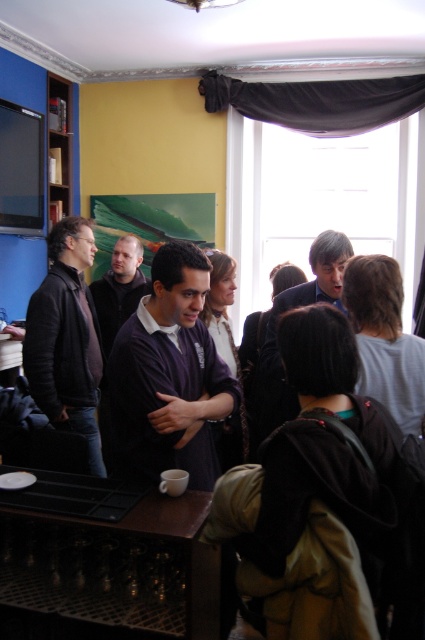
You are standing at the blue accent wall on the left side of the room and want to reach the table with the black tray. There are two points marked in the scene, point A at coordinates point A is point [235,396] and point B is point [127,250]. Which point should you walk towards to get to the table more quickly?

Point A at coordinates point [235,396] is in front of point B at coordinates point [127,250], so you should walk towards point A to reach the table more quickly.

You are standing in the room and want to pick up the purple sweater at center. Where should you look to find it?

The purple sweater at center is located at point 0.588 on the x axis and 0.398 on the y axis.

You are organizing a coat rack for guests at this event. The purple sweater at center and the dark brown leather jacket at left are currently misplaced. Which item should you hang first to ensure proper placement?

The dark brown leather jacket at left should be hung first because the purple sweater at center is positioned under it, indicating it belongs above the sweater.